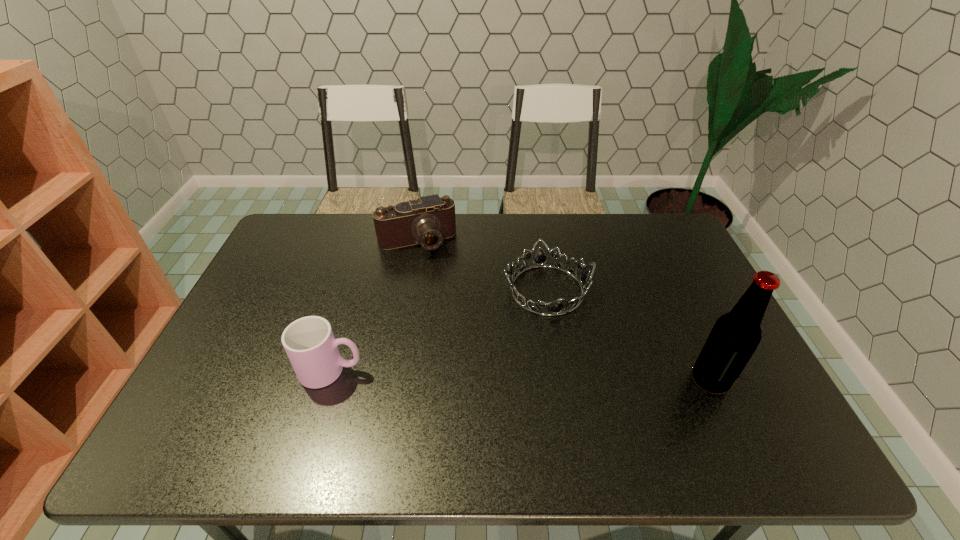
Image resolution: width=960 pixels, height=540 pixels. I want to click on vacant space at the near edge of the desktop, so click(396, 409).

Identify the location of vacant space at the left edge of the desktop. (278, 296).

Locate an element on the screen. vacant space at the right edge of the desktop is located at coordinates (668, 275).

Locate an element on the screen. This screenshot has width=960, height=540. vacant space at the far left corner is located at coordinates (303, 217).

At what (x,y) coordinates should I click in order to perform the action: click on free space that is in between the tiara and the beer bottle. Please return your answer as a coordinate pair (x, y). The height and width of the screenshot is (540, 960). Looking at the image, I should click on coord(629,335).

Find the location of a particular element. The width and height of the screenshot is (960, 540). vacant area that lies between the beer bottle and the cup is located at coordinates (520, 375).

Where is `unoccupied area between the rightmost object and the cup`? The height and width of the screenshot is (540, 960). unoccupied area between the rightmost object and the cup is located at coordinates (520, 375).

The width and height of the screenshot is (960, 540). I want to click on vacant space that's between the cup and the rightmost object, so click(x=520, y=375).

Image resolution: width=960 pixels, height=540 pixels. Find the location of `free space between the shortest object and the camera`. free space between the shortest object and the camera is located at coordinates (482, 266).

At what (x,y) coordinates should I click in order to perform the action: click on vacant space that is in between the farthest object and the cup. Please return your answer as a coordinate pair (x, y). This screenshot has width=960, height=540. Looking at the image, I should click on (374, 306).